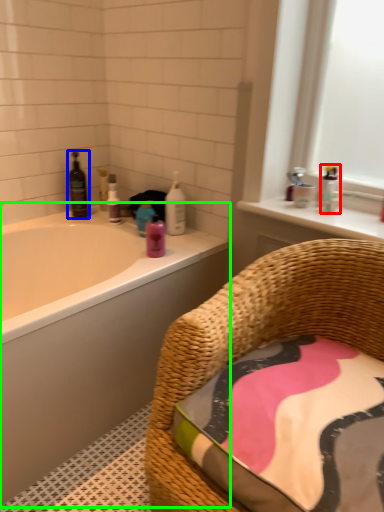
Question: Considering the real-world distances, which object is closest to toiletry (highlighted by a red box)? wine bottle (highlighted by a blue box) or bathtub (highlighted by a green box).

Choices:
 (A) wine bottle
 (B) bathtub

Answer: (B)